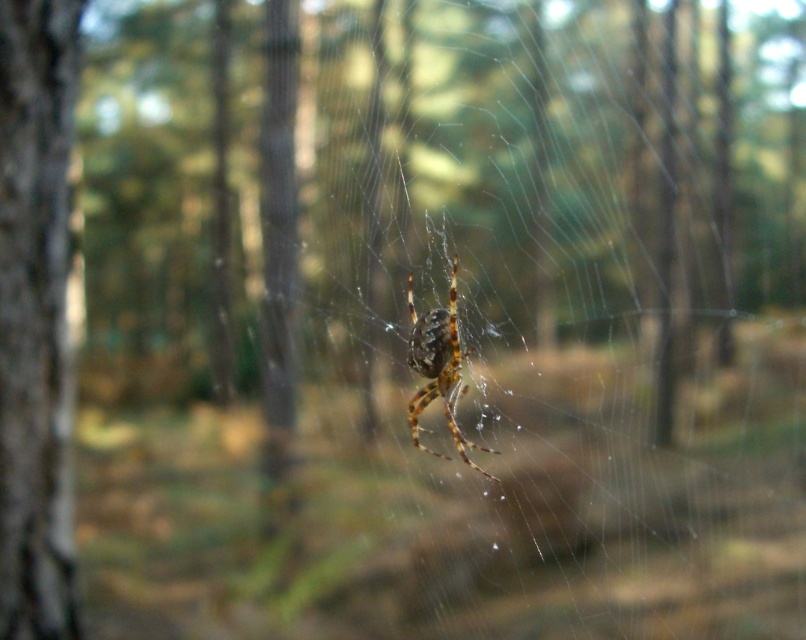
Is brown rough bark at left taller than brown fuzzy spider at center?

Indeed, brown rough bark at left has a greater height compared to brown fuzzy spider at center.

Does brown rough bark at left have a greater width compared to brown fuzzy spider at center?

Incorrect, brown rough bark at left's width does not surpass brown fuzzy spider at center's.

The image size is (806, 640). In order to click on brown rough bark at left in this screenshot , I will do `click(35, 317)`.